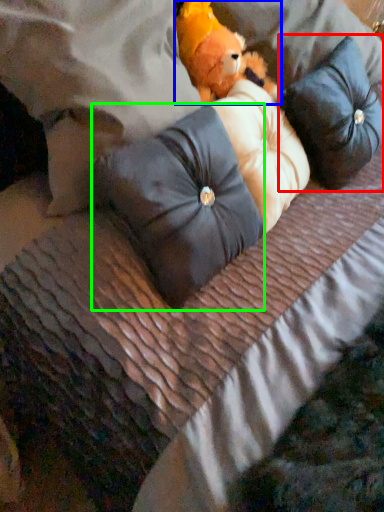
Question: Estimate the real-world distances between objects in this image. Which object is farther from pillow (highlighted by a red box), teddy bear (highlighted by a blue box) or pillow (highlighted by a green box)?

Choices:
 (A) teddy bear
 (B) pillow

Answer: (B)